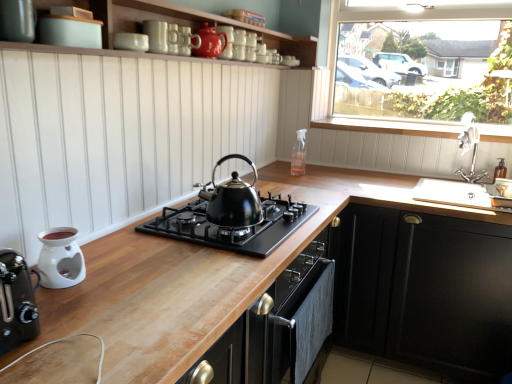
Find the location of a particular element. The image size is (512, 384). empty space that is ontop of wooden at center (from a real-world perspective) is located at coordinates (325, 206).